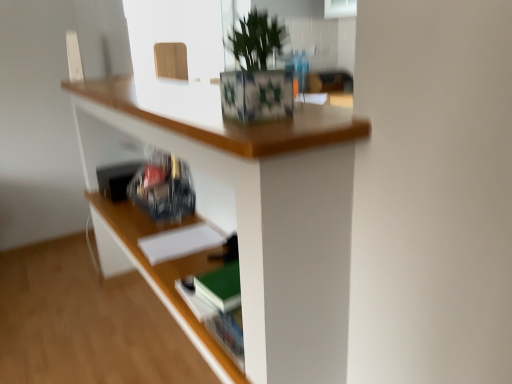
Image resolution: width=512 pixels, height=384 pixels. In order to click on vacant region to the left of green leafy plant at upper center in this screenshot , I will do `click(199, 120)`.